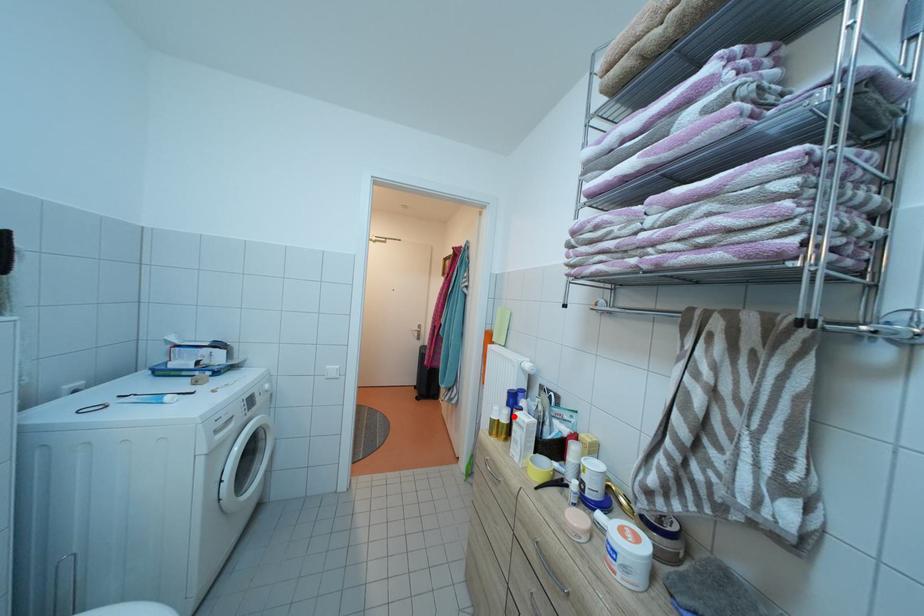
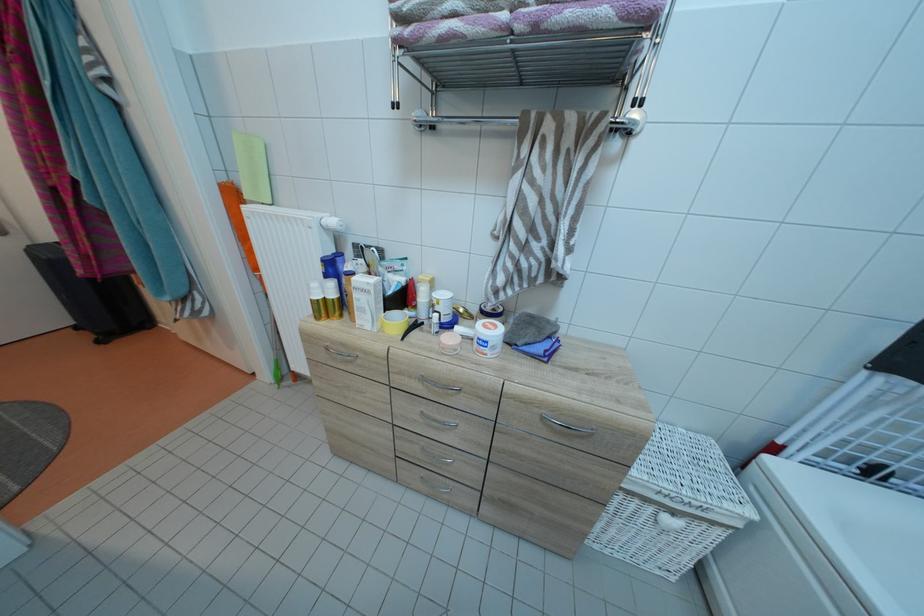
Locate, in the second image, the point that corresponds to the highlighted location in the first image.

(338, 290)